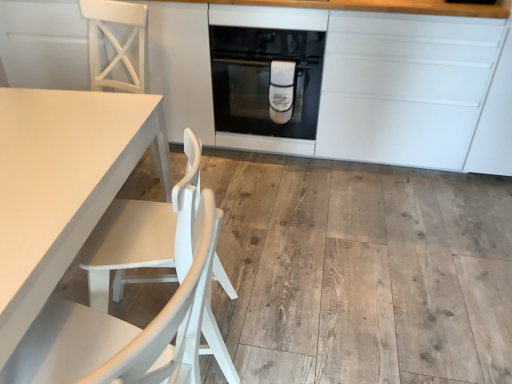
Question: Is white matte table at left surrounded by black glass oven at center?

Choices:
 (A) no
 (B) yes

Answer: (A)

Question: Is black glass oven at center to the right of white matte table at left from the viewer's perspective?

Choices:
 (A) no
 (B) yes

Answer: (B)

Question: Can you see black glass oven at center touching white matte table at left?

Choices:
 (A) no
 (B) yes

Answer: (A)

Question: Can we say black glass oven at center lies outside white matte table at left?

Choices:
 (A) yes
 (B) no

Answer: (A)

Question: From the image's perspective, is black glass oven at center over white matte table at left?

Choices:
 (A) no
 (B) yes

Answer: (B)

Question: Is black glass oven at center oriented towards white matte table at left?

Choices:
 (A) yes
 (B) no

Answer: (A)

Question: From the image's perspective, is white matte cabinetry at center over white matte wood chair at lower left, the first chair in the bottom-to-top sequence?

Choices:
 (A) no
 (B) yes

Answer: (B)

Question: From a real-world perspective, is white matte cabinetry at center located beneath white matte wood chair at lower left, the first chair in the bottom-to-top sequence?

Choices:
 (A) no
 (B) yes

Answer: (A)

Question: Is white matte wood chair at lower left, the 2th chair viewed from the back, completely or partially inside white matte cabinetry at center?

Choices:
 (A) no
 (B) yes

Answer: (A)

Question: Can you confirm if white matte cabinetry at center is bigger than white matte wood chair at lower left, the 2th chair viewed from the back?

Choices:
 (A) yes
 (B) no

Answer: (A)

Question: Can we say white matte cabinetry at center lies outside white matte wood chair at lower left, the first chair in the bottom-to-top sequence?

Choices:
 (A) no
 (B) yes

Answer: (B)

Question: Can you confirm if white matte cabinetry at center is thinner than white matte wood chair at lower left, the first chair in the bottom-to-top sequence?

Choices:
 (A) no
 (B) yes

Answer: (A)

Question: Is white matte chair at left, the 1th chair positioned from the top, at the right side of white matte cabinetry at center?

Choices:
 (A) no
 (B) yes

Answer: (A)